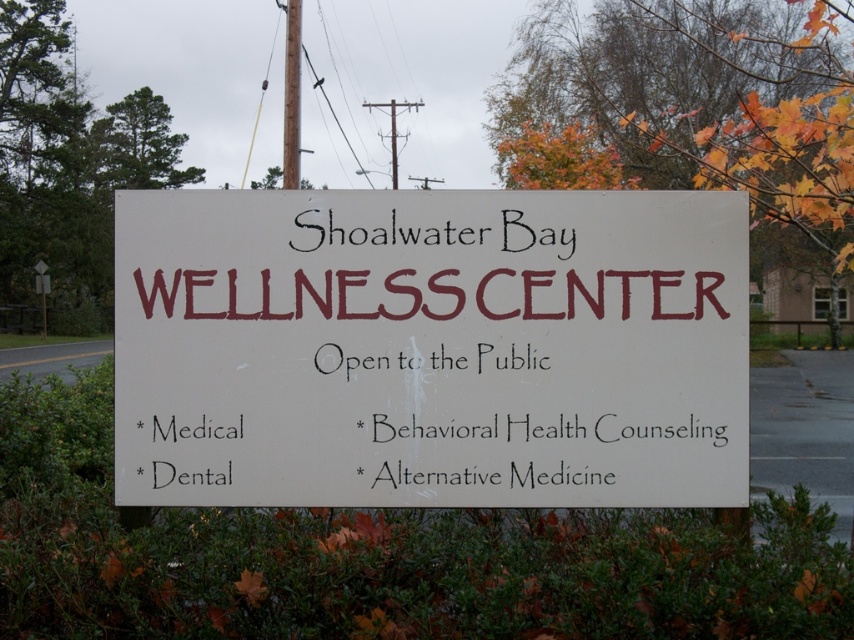
Between white matte sign at center and white plastic sign at upper center, which one is positioned higher?

white plastic sign at upper center is higher up.

Is white matte sign at center smaller than white plastic sign at upper center?

Indeed, white matte sign at center has a smaller size compared to white plastic sign at upper center.

Is point (510, 228) farther from camera compared to point (42, 268)?

No, it is in front of (42, 268).

Locate an element on the screen. The image size is (854, 640). white matte sign at center is located at coordinates (430, 348).